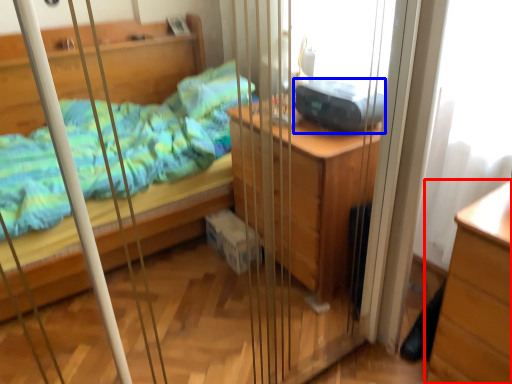
Question: Among these objects, which one is nearest to the camera, chest of drawers (highlighted by a red box) or equipment (highlighted by a blue box)?

Choices:
 (A) chest of drawers
 (B) equipment

Answer: (A)